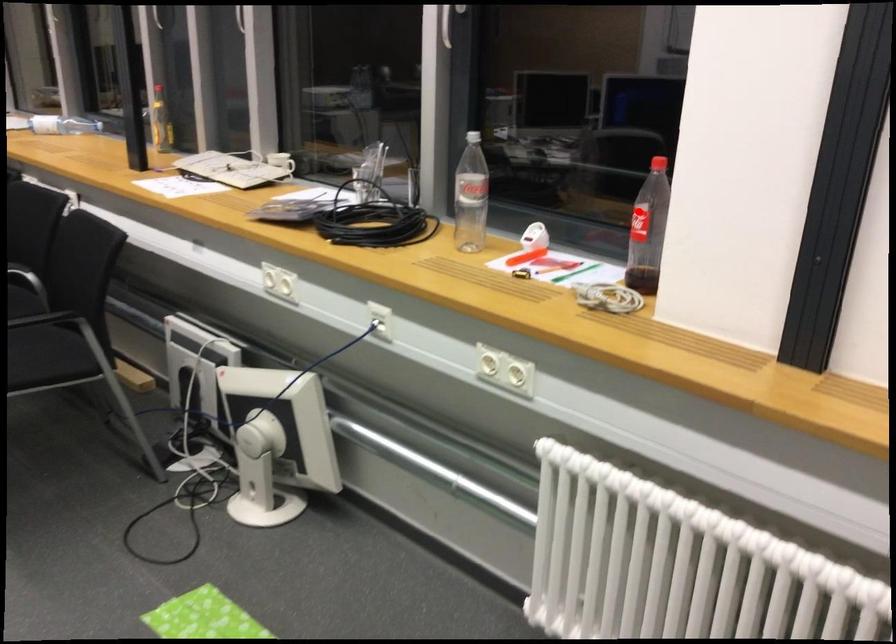
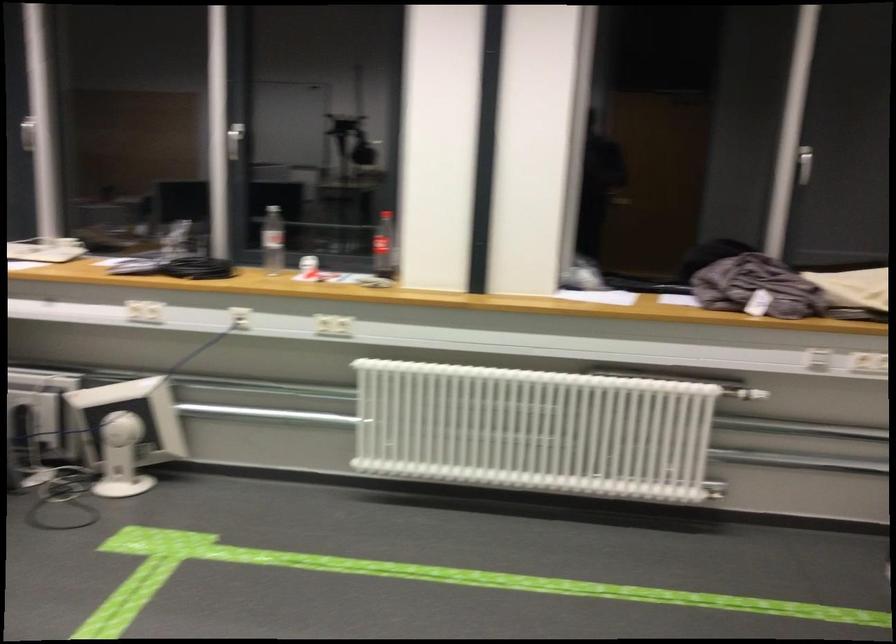
Question: A red point is marked in image1. In image2, is the corresponding 3D point closer to the camera or farther? Reply with the corresponding letter.

Choices:
 (A) The corresponding 3D point is closer.
 (B) The corresponding 3D point is farther.

Answer: (B)